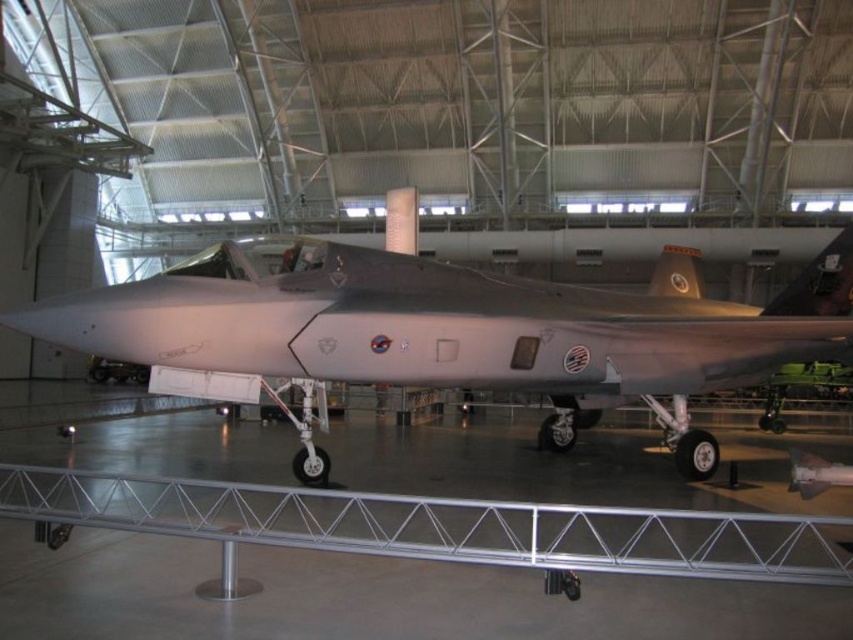
Looking at this image, who is taller, matte gray airplane at center or silver/metallic rail at lower center?

silver/metallic rail at lower center is taller.

Is matte gray airplane at center to the left of silver/metallic rail at lower center from the viewer's perspective?

No, matte gray airplane at center is not to the left of silver/metallic rail at lower center.

Is point (24, 321) positioned in front of point (714, 529)?

That is False.

You are a GUI agent. You are given a task and a screenshot of the screen. Output one action in this format:
    pyautogui.click(x=<x>, y=<y>)
    Task: Click on the matte gray airplane at center
    This screenshot has width=853, height=640.
    Given the screenshot: What is the action you would take?
    pyautogui.click(x=453, y=324)